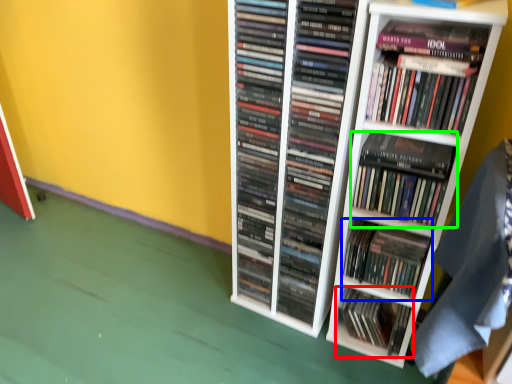
Question: Which object is the closest to the book (highlighted by a red box)? Choose among these: book (highlighted by a blue box) or book (highlighted by a green box).

Choices:
 (A) book
 (B) book

Answer: (A)